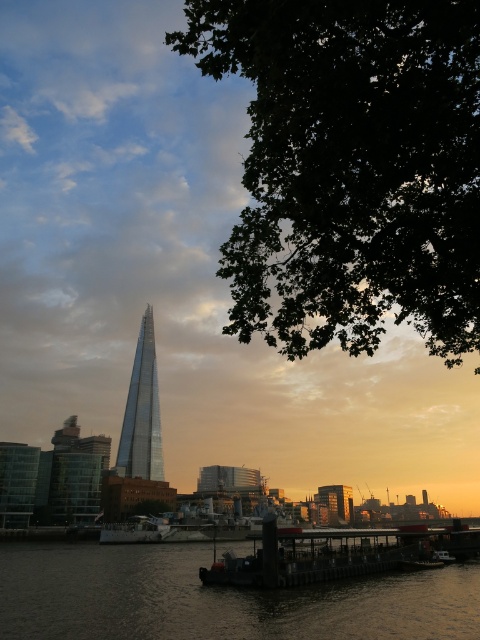
Question: Among these objects, which one is nearest to the camera?

Choices:
 (A) brown water at lower left
 (B) green leafy tree at center

Answer: (A)

Question: Estimate the real-world distances between objects in this image. Which object is farther from the glassy metallic tower at center?

Choices:
 (A) brown water at lower left
 (B) metallic gray ship at center

Answer: (A)

Question: Is green leafy tree at upper right to the right of green leafy tree at center from the viewer's perspective?

Choices:
 (A) no
 (B) yes

Answer: (B)

Question: Does green leafy tree at upper right have a greater width compared to metallic gray ship at center?

Choices:
 (A) yes
 (B) no

Answer: (B)

Question: Which of these objects is positioned closest to the green leafy tree at upper right?

Choices:
 (A) brown water at lower left
 (B) green leafy tree at center

Answer: (A)

Question: Is green leafy tree at upper right to the left of glassy metallic tower at center from the viewer's perspective?

Choices:
 (A) no
 (B) yes

Answer: (A)